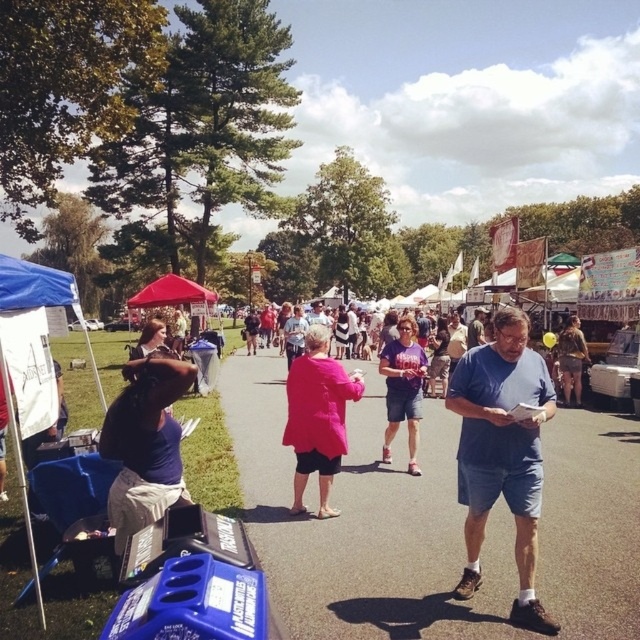
You are at a fair and see two people wearing shirts. One is a dark blue shirt at lower left and the other is a purple cotton shirt at center. Which person is closer to you?

The dark blue shirt at lower left is closer to you because it is in front of the purple cotton shirt at center.